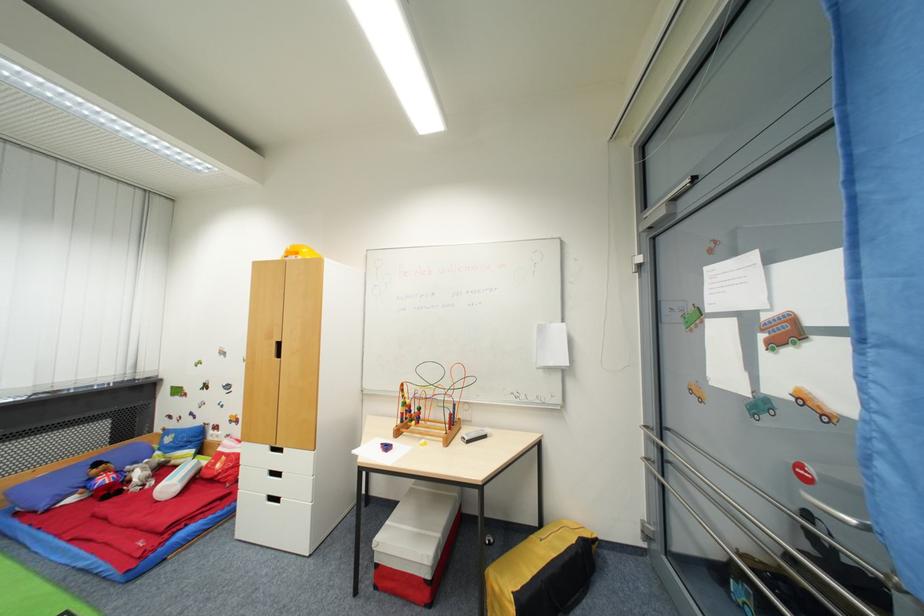
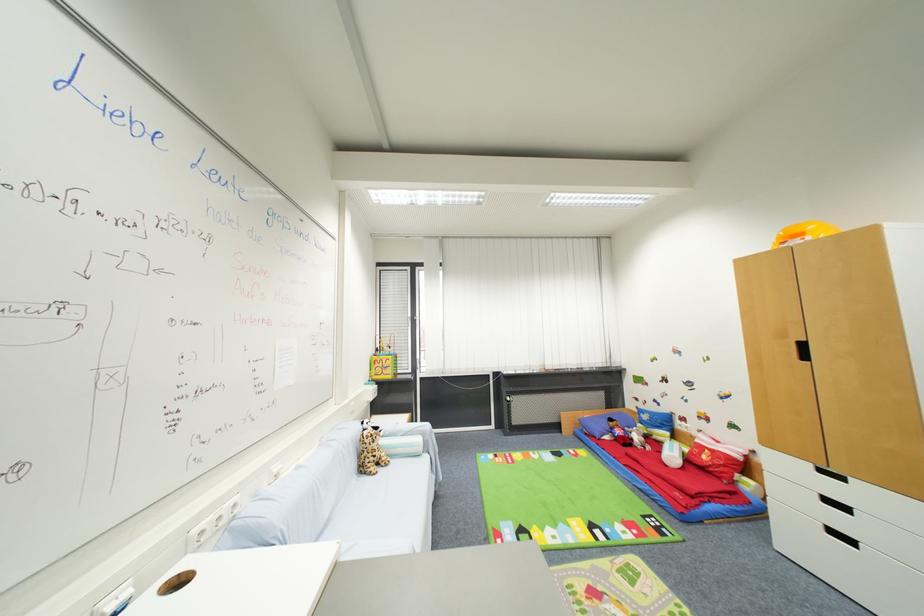
Question: The images are taken continuously from a first-person perspective. In which direction is your viewpoint rotating?

Choices:
 (A) Left
 (B) Right
 (C) Up
 (D) Down

Answer: (A)